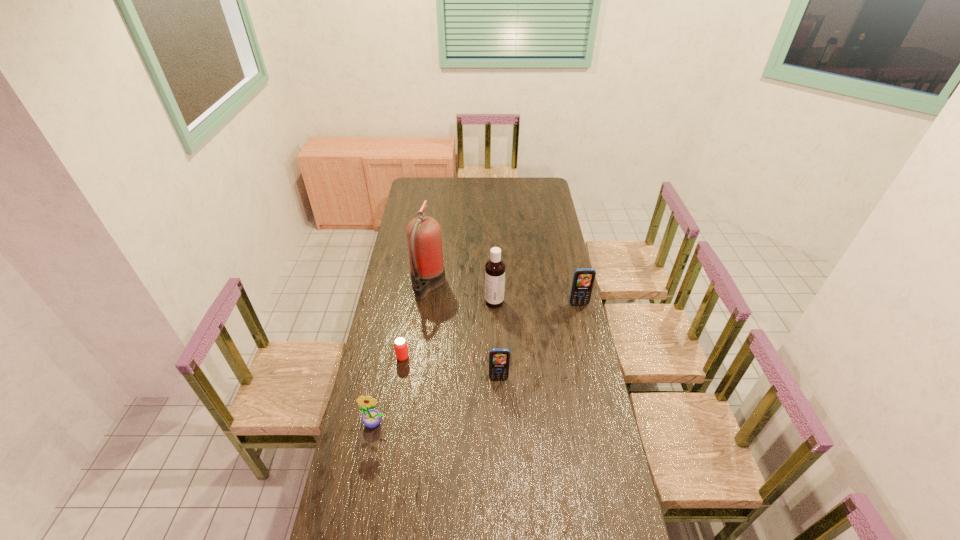
In the current image, all cellular telephones are evenly spaced. To maintain this equal spacing, where should an additional cellular telephone be placed on the left? Please point out a free spot. Please provide its 2D coordinates. Your answer should be formatted as a tuple, i.e. [(x, y)], where the tuple contains the x and y coordinates of a point satisfying the conditions above.

[(385, 484)]